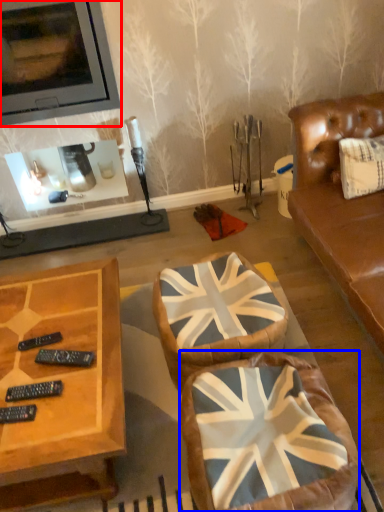
Question: Which point is further to the camera, picture frame (highlighted by a red box) or swivel chair (highlighted by a blue box)?

Choices:
 (A) picture frame
 (B) swivel chair

Answer: (A)